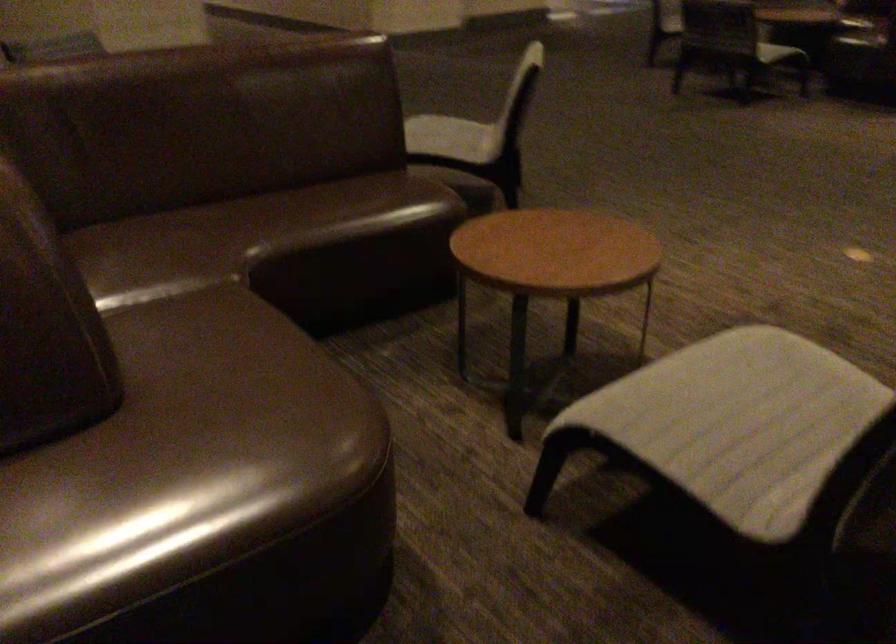
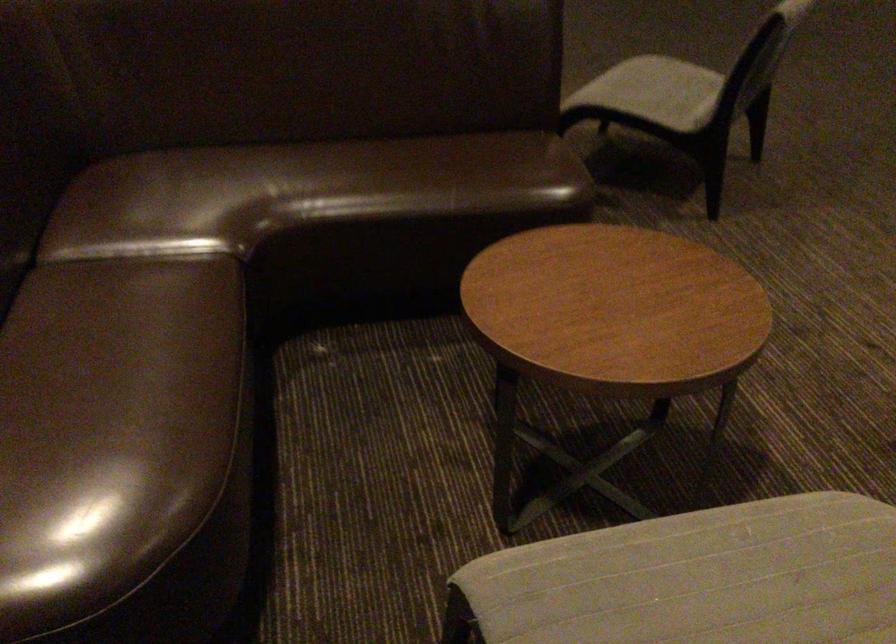
Where in the second image is the point corresponding to point (463, 140) from the first image?

(655, 91)